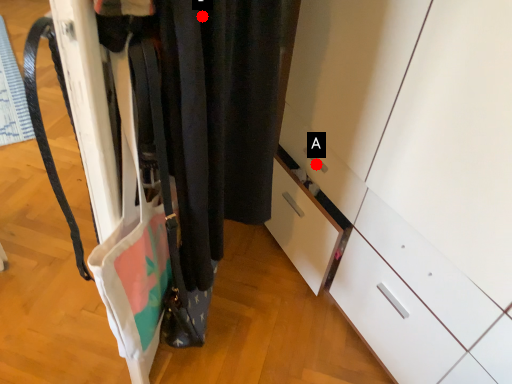
Question: Two points are circled on the image, labeled by A and B beside each circle. Which point is closer to the camera?

Choices:
 (A) A is closer
 (B) B is closer

Answer: (B)